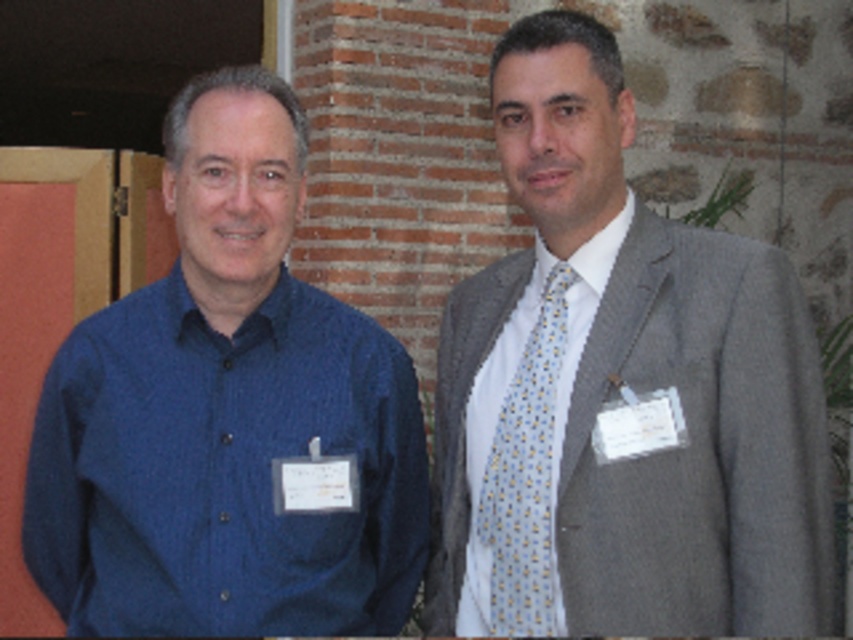
Is gray textured suit at right to the right of blue textured shirt at left from the viewer's perspective?

Correct, you'll find gray textured suit at right to the right of blue textured shirt at left.

Is point (544, 92) farther from viewer compared to point (138, 440)?

Yes, it is.

Find the location of a particular element. gray textured suit at right is located at coordinates (614, 387).

The width and height of the screenshot is (853, 640). What do you see at coordinates (225, 413) in the screenshot? I see `blue textured shirt at left` at bounding box center [225, 413].

Who is shorter, blue textured shirt at left or white textured shirt at center?

white textured shirt at center is shorter.

What do you see at coordinates (225, 413) in the screenshot? The width and height of the screenshot is (853, 640). I see `blue textured shirt at left` at bounding box center [225, 413].

What are the coordinates of `blue textured shirt at left` in the screenshot? It's located at (225, 413).

Who is positioned more to the right, gray textured suit at right or light blue silk tie at right?

Positioned to the right is gray textured suit at right.

Measure the distance from gray textured suit at right to light blue silk tie at right.

4.96 inches

Locate an element on the screen. Image resolution: width=853 pixels, height=640 pixels. gray textured suit at right is located at coordinates (614, 387).